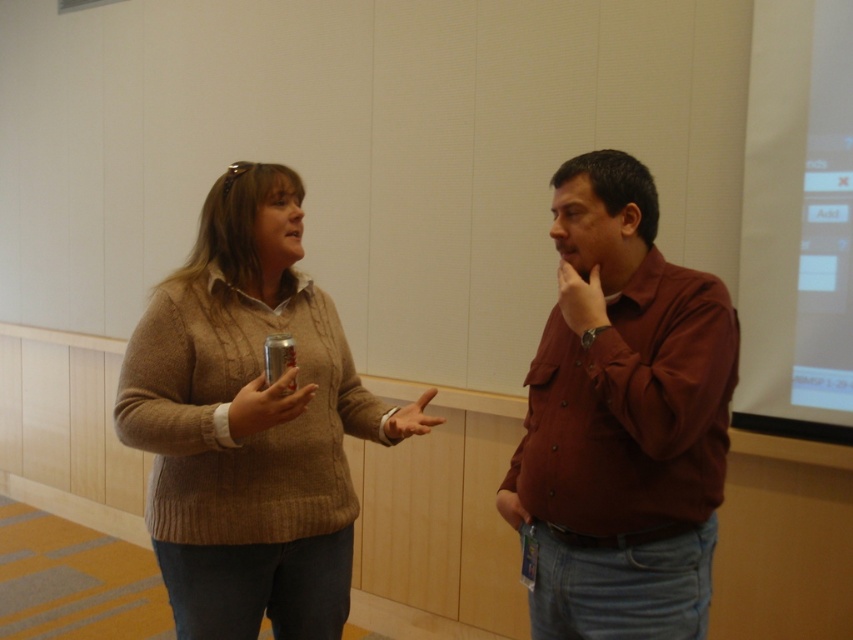
Question: Is matte brown shirt at center further to camera compared to metallic can at center?

Choices:
 (A) no
 (B) yes

Answer: (A)

Question: Is the position of knitted sweater at center more distant than that of metallic can at center?

Choices:
 (A) yes
 (B) no

Answer: (B)

Question: Does knitted sweater at center appear under metallic can at center?

Choices:
 (A) yes
 (B) no

Answer: (A)

Question: Which object appears farthest from the camera in this image?

Choices:
 (A) matte brown shirt at center
 (B) metallic can at center
 (C) knitted sweater at center

Answer: (B)

Question: Which of the following is the closest to the observer?

Choices:
 (A) (352, 525)
 (B) (280, 355)
 (C) (596, 456)

Answer: (C)

Question: Which is nearer to the metallic can at center?

Choices:
 (A) matte brown shirt at center
 (B) knitted sweater at center

Answer: (B)